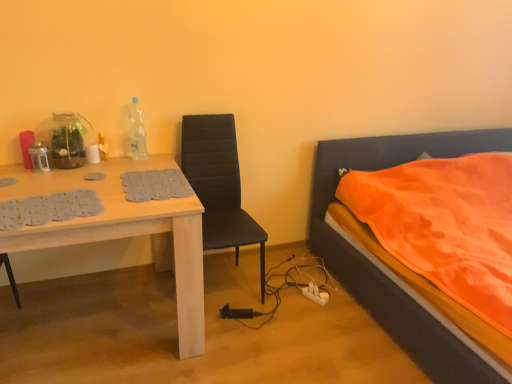
What do you see at coordinates (136, 131) in the screenshot?
I see `transparent plastic bottle at upper center` at bounding box center [136, 131].

The width and height of the screenshot is (512, 384). Identify the location of black leather chair at center. (219, 185).

Looking at this image, from the image's perspective, is white plastic power outlet at lower center on light wood table at left?

Actually, white plastic power outlet at lower center appears below light wood table at left in the image.

Is white plastic power outlet at lower center shorter than light wood table at left?

Correct, white plastic power outlet at lower center is not as tall as light wood table at left.

Is light wood table at left at the back of white plastic power outlet at lower center?

No, white plastic power outlet at lower center is not facing away from light wood table at left.

From the image's perspective, is transparent plastic bottle at upper center located beneath orange fabric bed at right?

Actually, transparent plastic bottle at upper center appears above orange fabric bed at right in the image.

Is transparent plastic bottle at upper center oriented away from orange fabric bed at right?

That's not correct — transparent plastic bottle at upper center is not looking away from orange fabric bed at right.

Considering the relative sizes of transparent plastic bottle at upper center and orange fabric bed at right in the image provided, is transparent plastic bottle at upper center thinner than orange fabric bed at right?

Indeed, transparent plastic bottle at upper center has a lesser width compared to orange fabric bed at right.

Which object is positioned more to the left, transparent plastic bottle at upper center or orange fabric bed at right?

transparent plastic bottle at upper center is more to the left.

Would you say black leather chair at center is a long distance from transparent plastic bottle at upper center?

black leather chair at center is actually quite close to transparent plastic bottle at upper center.

From the picture: Is black leather chair at center smaller than transparent plastic bottle at upper center?

Incorrect, black leather chair at center is not smaller in size than transparent plastic bottle at upper center.

Is black leather chair at center to the left or to the right of transparent plastic bottle at upper center in the image?

black leather chair at center is to the right of transparent plastic bottle at upper center.

Is black leather chair at center completely or partially outside of transparent plastic bottle at upper center?

black leather chair at center lies outside transparent plastic bottle at upper center's area.

From the image's perspective, is orange fabric bed at right positioned above or below transparent plastic bottle at upper center?

orange fabric bed at right is situated lower than transparent plastic bottle at upper center in the image.

Based on the photo, is transparent plastic bottle at upper center completely or partially inside orange fabric bed at right?

No, transparent plastic bottle at upper center is not a part of orange fabric bed at right.

From a real-world perspective, does black leather chair at center stand above orange fabric bed at right?

Indeed, from a real-world perspective, black leather chair at center stands above orange fabric bed at right.

Is black leather chair at center not near orange fabric bed at right?

No, black leather chair at center is not far from orange fabric bed at right.

Can you confirm if black leather chair at center is taller than orange fabric bed at right?

Correct, black leather chair at center is much taller as orange fabric bed at right.

From a real-world perspective, is orange fabric bed at right over black leather chair at center?

Incorrect, from a real-world perspective, orange fabric bed at right is lower than black leather chair at center.

Does point (370, 281) come in front of point (253, 238)?

No, (370, 281) is behind (253, 238).

What are the coordinates of `bed that appears on the right of black leather chair at center` in the screenshot? It's located at (376, 268).

Is transparent plastic bottle at upper center next to black leather chair at center?

transparent plastic bottle at upper center is not next to black leather chair at center, and they're not touching.

From the image's perspective, which one is positioned lower, transparent plastic bottle at upper center or black leather chair at center?

From the image's view, black leather chair at center is below.

Considering the relative sizes of transparent plastic bottle at upper center and black leather chair at center in the image provided, is transparent plastic bottle at upper center wider than black leather chair at center?

No.

From a real-world perspective, is transparent plastic bottle at upper center located beneath black leather chair at center?

Incorrect, from a real-world perspective, transparent plastic bottle at upper center is higher than black leather chair at center.

Locate an element on the screen. The image size is (512, 384). desk on the left of the white plastic power outlet at lower center is located at coordinates (124, 230).

I want to click on bottle above the orange fabric bed at right (from the image's perspective), so click(x=136, y=131).

Based on their spatial positions, is transparent plastic bottle at upper center or black leather chair at center further from white plastic power outlet at lower center?

transparent plastic bottle at upper center is positioned further to the anchor white plastic power outlet at lower center.

Considering their positions, is transparent plastic bottle at upper center positioned closer to white plastic power outlet at lower center than orange fabric bed at right?

Among the two, orange fabric bed at right is located nearer to white plastic power outlet at lower center.

When comparing their distances from white plastic power outlet at lower center, does orange fabric bed at right or light wood table at left seem closer?

orange fabric bed at right is positioned closer to the anchor white plastic power outlet at lower center.

When comparing their distances from black leather chair at center, does white plastic power outlet at lower center or light wood table at left seem closer?

Based on the image, light wood table at left appears to be nearer to black leather chair at center.

Looking at the image, which one is located closer to white plastic power outlet at lower center, light wood table at left or black leather chair at center?

black leather chair at center lies closer to white plastic power outlet at lower center than the other object.

From the image, which object appears to be nearer to orange fabric bed at right, light wood table at left or transparent plastic bottle at upper center?

light wood table at left is positioned closer to the anchor orange fabric bed at right.

Estimate the real-world distances between objects in this image. Which object is further from black leather chair at center, white plastic power outlet at lower center or transparent plastic bottle at upper center?

The object further to black leather chair at center is white plastic power outlet at lower center.

From the image, which object appears to be farther from light wood table at left, orange fabric bed at right or transparent plastic bottle at upper center?

orange fabric bed at right.

At what (x,y) coordinates should I click in order to perform the action: click on chair located between light wood table at left and orange fabric bed at right in the left-right direction. Please return your answer as a coordinate pair (x, y). The width and height of the screenshot is (512, 384). Looking at the image, I should click on (219, 185).

Locate an element on the screen. This screenshot has width=512, height=384. power outlet between light wood table at left and orange fabric bed at right is located at coordinates (315, 294).

I want to click on power outlet between black leather chair at center and orange fabric bed at right, so click(315, 294).

Where is `bottle between light wood table at left and orange fabric bed at right in the horizontal direction`? bottle between light wood table at left and orange fabric bed at right in the horizontal direction is located at coordinates click(x=136, y=131).